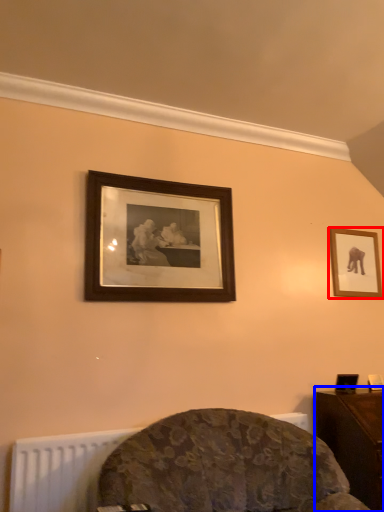
Question: Which point is closer to the camera, picture frame (highlighted by a red box) or table (highlighted by a blue box)?

Choices:
 (A) picture frame
 (B) table

Answer: (B)